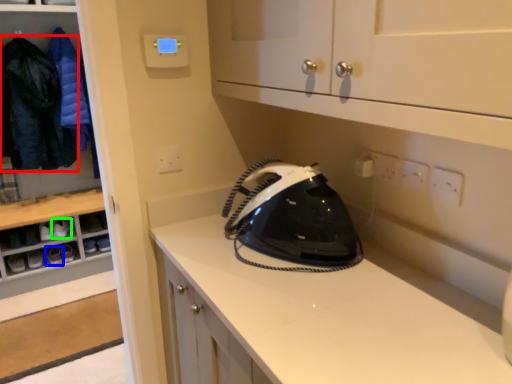
Question: Which is nearer to the clothing (highlighted by a red box)? footwear (highlighted by a blue box) or footwear (highlighted by a green box).

Choices:
 (A) footwear
 (B) footwear

Answer: (B)